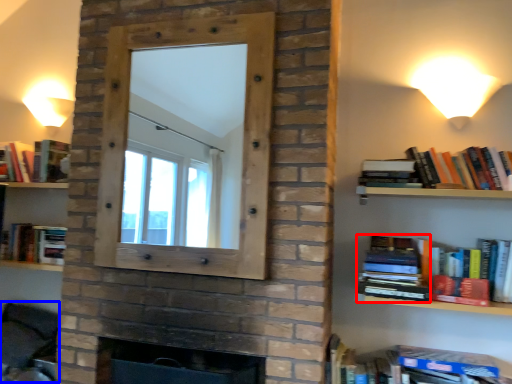
Question: Which object is further to the camera taking this photo, paperback book (highlighted by a red box) or swivel chair (highlighted by a blue box)?

Choices:
 (A) paperback book
 (B) swivel chair

Answer: (B)